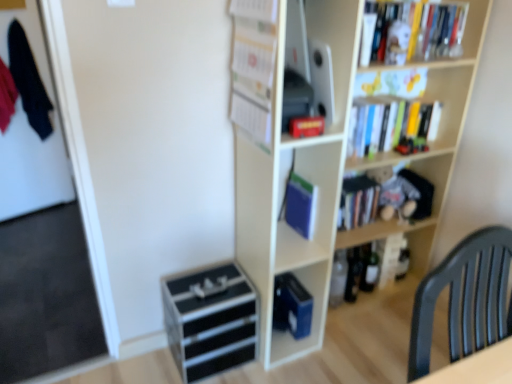
This screenshot has height=384, width=512. I want to click on spots to the right of blue matte book at center, the first paperback book ordered from the bottom, so click(x=338, y=342).